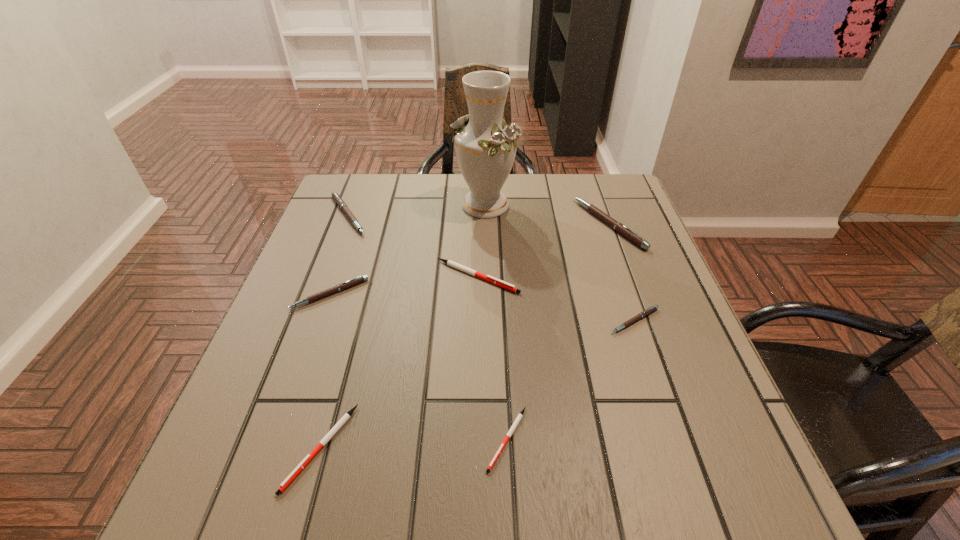
Where is `the shortest object`? This screenshot has height=540, width=960. the shortest object is located at coordinates (520, 415).

The height and width of the screenshot is (540, 960). Identify the location of free space located 0.330m on the right of the tallest object. (634, 205).

Locate an element on the screen. vacant space located at the nib of the biggest pink pen is located at coordinates (546, 224).

The height and width of the screenshot is (540, 960). In order to click on vacant space located at the nib of the biggest pink pen in this screenshot , I will do `click(505, 224)`.

Identify the location of blank space located at the nib of the biggest pink pen. The image size is (960, 540). (437, 224).

Locate an element on the screen. free space located at the nib of the second biggest pink pen is located at coordinates (422, 215).

The width and height of the screenshot is (960, 540). I want to click on vacant space situated at the nib of the third biggest pink pen, so click(x=283, y=428).

Where is `blank space located on the clicker of the biggest white pen`? blank space located on the clicker of the biggest white pen is located at coordinates (563, 276).

Identify the location of vacant space situated 0.090m at the nib of the smallest pink pen. (652, 372).

Locate an element on the screen. The image size is (960, 540). vase that is at the far edge is located at coordinates (485, 146).